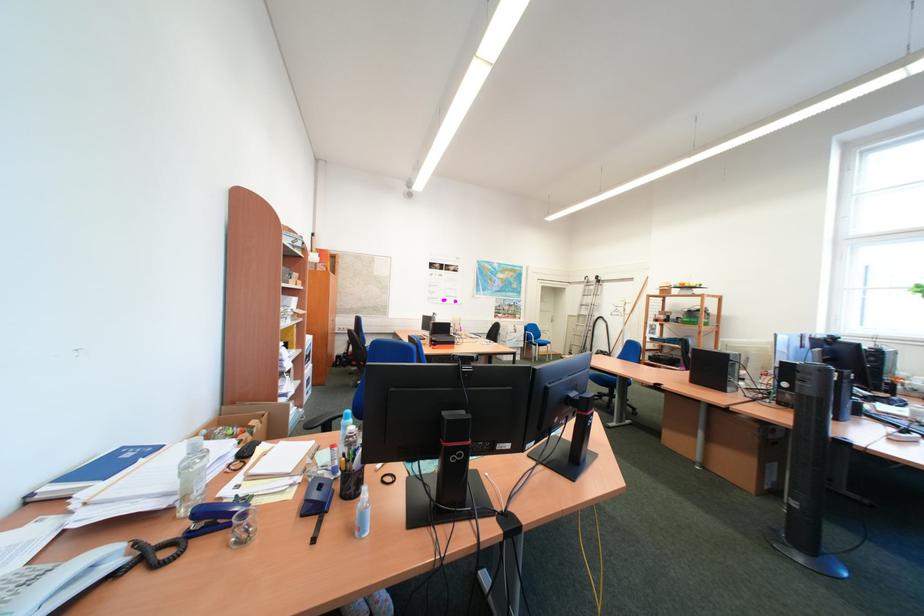
Find the location of a particular element. The width and height of the screenshot is (924, 616). chair armrest is located at coordinates (322, 421).